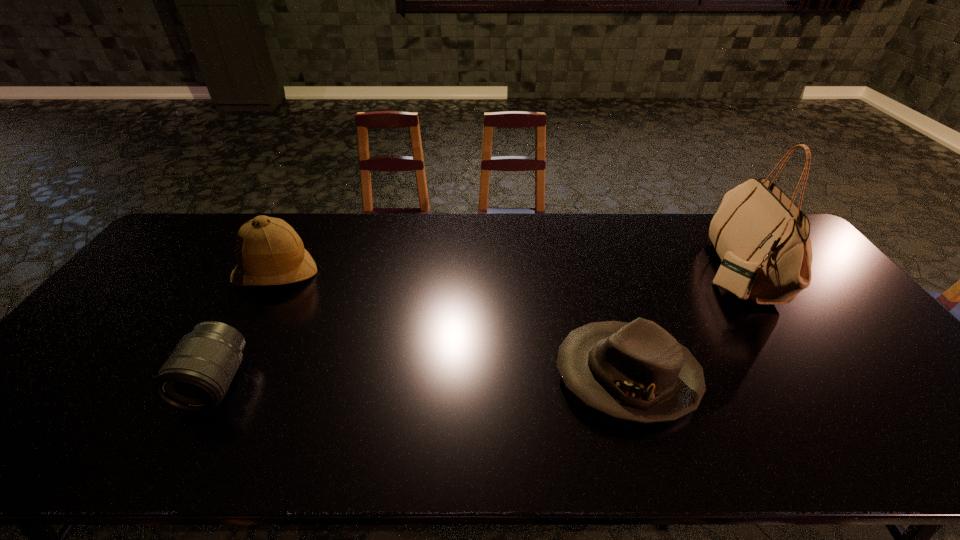
The width and height of the screenshot is (960, 540). I want to click on blank space at the far edge of the desktop, so click(376, 216).

I want to click on free space at the near edge of the desktop, so click(432, 434).

The height and width of the screenshot is (540, 960). Find the location of `vacant space at the left edge`. vacant space at the left edge is located at coordinates (77, 374).

Locate an element on the screen. free space at the right edge of the desktop is located at coordinates (834, 315).

Locate an element on the screen. This screenshot has height=540, width=960. free space between the shorter hat and the left hat is located at coordinates (451, 325).

Where is `vacant area between the third object from left to right and the rightmost object`? The image size is (960, 540). vacant area between the third object from left to right and the rightmost object is located at coordinates (682, 323).

The height and width of the screenshot is (540, 960). Identify the location of free spot between the third object from left to right and the tallest object. (682, 323).

The height and width of the screenshot is (540, 960). I want to click on free spot between the handbag and the left hat, so click(x=506, y=272).

What are the coordinates of `free space between the handbag and the telephoto lens` in the screenshot? It's located at (476, 327).

I want to click on vacant space that is in between the handbag and the nearer hat, so click(682, 323).